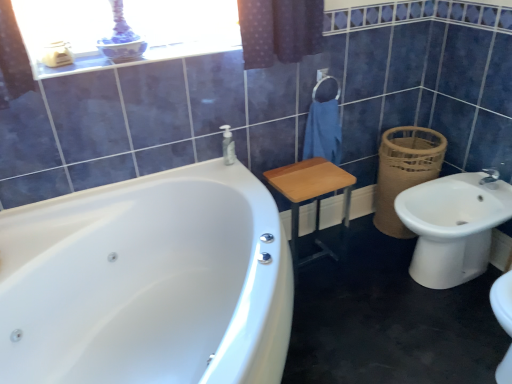
At what (x,y) coordinates should I click in order to perform the action: click on vacant space in white glossy sink at lower right (from a real-world perspective). Please return your answer as a coordinate pair (x, y). This screenshot has width=512, height=384. Looking at the image, I should click on (439, 284).